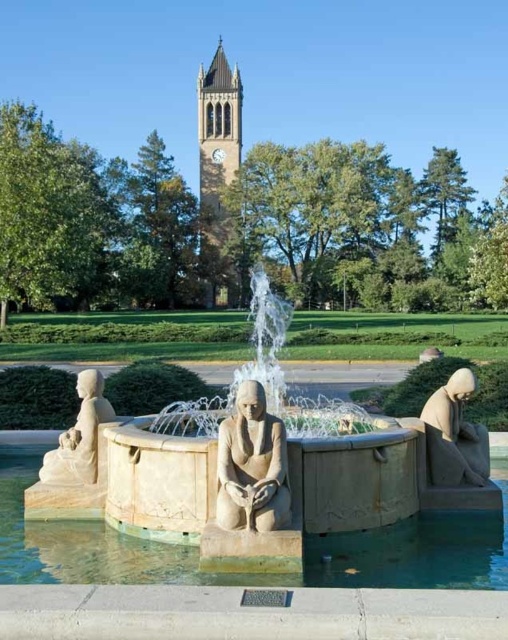
Who is more forward, (461, 586) or (434, 436)?

Positioned in front is point (461, 586).

Which is above, smooth stone fountain at center or matte stone statue at lower right?

matte stone statue at lower right is higher up.

Identify the location of smooth stone fountain at center. This screenshot has height=640, width=508. (250, 573).

Locate an element on the screen. smooth stone fountain at center is located at coordinates (250, 573).

Is smooth stone statue at center bigger than matte stone statue at lower right?

Actually, smooth stone statue at center might be smaller than matte stone statue at lower right.

From the picture: Measure the distance between smooth stone statue at center and matte stone statue at lower right.

A distance of 6.01 meters exists between smooth stone statue at center and matte stone statue at lower right.

Is point (268, 497) in front of point (444, 413)?

Yes, it is.

Locate an element on the screen. The width and height of the screenshot is (508, 640). smooth stone statue at center is located at coordinates (251, 465).

Can you confirm if matte stone statue at lower right is positioned below beige stone statue at lower left?

No.

The height and width of the screenshot is (640, 508). What are the coordinates of `matte stone statue at lower right` in the screenshot? It's located at click(x=455, y=435).

Find the location of a particular element. This screenshot has width=508, height=640. matte stone statue at lower right is located at coordinates (455, 435).